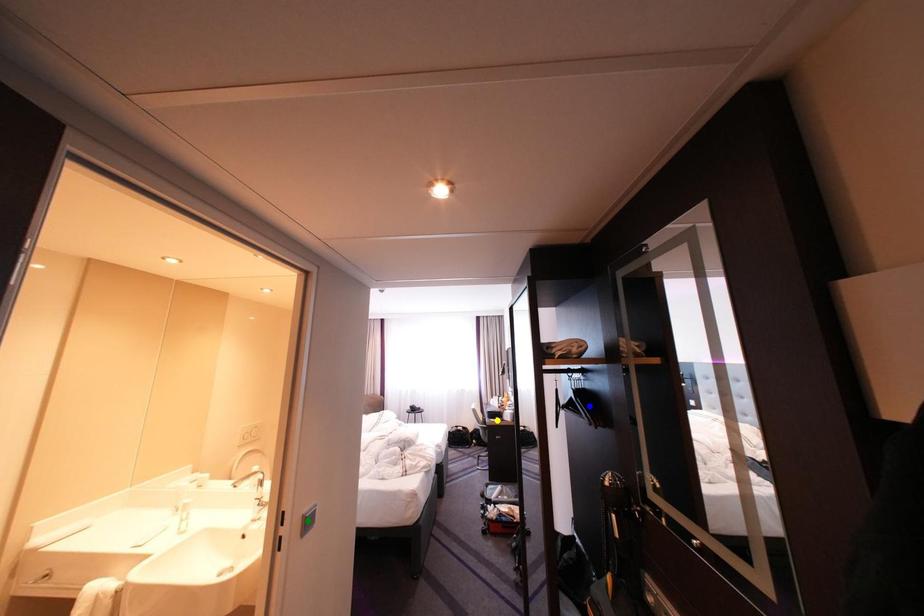
Order these from nearest to farthest:
- green point
- yellow point
- blue point

1. green point
2. blue point
3. yellow point